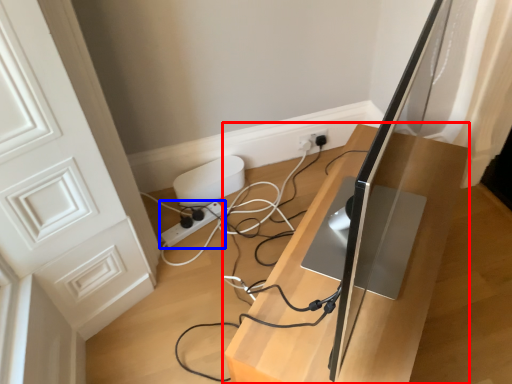
Question: Which point is further to the camera, furniture (highlighted by a red box) or extension cord (highlighted by a blue box)?

Choices:
 (A) furniture
 (B) extension cord

Answer: (B)